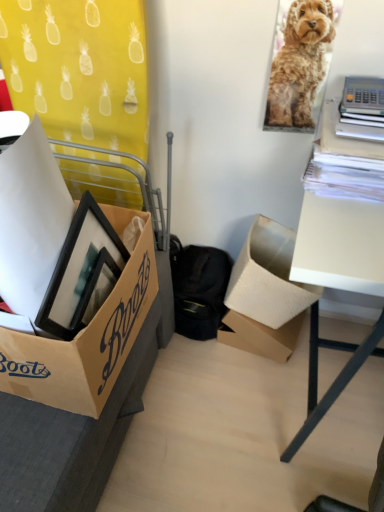
Question: Can you confirm if cardboard box at lower right, the third box viewed from the left, is thinner than brown cardboard box at center, the second box positioned from the left?

Choices:
 (A) yes
 (B) no

Answer: (B)

Question: Is cardboard box at lower right, which is the 1th box in right-to-left order, positioned in front of brown cardboard box at center, the second box positioned from the left?

Choices:
 (A) no
 (B) yes

Answer: (B)

Question: From a real-world perspective, is cardboard box at lower right, which is the 1th box in right-to-left order, located beneath brown cardboard box at center, the second box positioned from the left?

Choices:
 (A) yes
 (B) no

Answer: (B)

Question: Does cardboard box at lower right, the third box viewed from the left, have a lesser height compared to brown cardboard box at center, the second box positioned from the left?

Choices:
 (A) no
 (B) yes

Answer: (A)

Question: Is cardboard box at lower right, the third box viewed from the left, turned away from brown cardboard box at center, the second box positioned from the left?

Choices:
 (A) no
 (B) yes

Answer: (A)

Question: Choose the correct answer: Is brown cardboard box at lower left, marked as the first box in a left-to-right arrangement, inside white matte table at right or outside it?

Choices:
 (A) inside
 (B) outside

Answer: (B)

Question: Would you say brown cardboard box at lower left, positioned as the 3th box in right-to-left order, is to the left or to the right of white matte table at right in the picture?

Choices:
 (A) right
 (B) left

Answer: (B)

Question: Is point click(x=92, y=415) closer or farther from the camera than point click(x=357, y=287)?

Choices:
 (A) closer
 (B) farther

Answer: (B)

Question: In terms of size, does brown cardboard box at lower left, marked as the first box in a left-to-right arrangement, appear bigger or smaller than white matte table at right?

Choices:
 (A) big
 (B) small

Answer: (B)

Question: Is golden fur dog at upper right bigger or smaller than cardboard box at lower right, the third box viewed from the left?

Choices:
 (A) small
 (B) big

Answer: (A)

Question: From the image's perspective, is golden fur dog at upper right above or below cardboard box at lower right, the third box viewed from the left?

Choices:
 (A) above
 (B) below

Answer: (A)

Question: From their relative heights in the image, would you say golden fur dog at upper right is taller or shorter than cardboard box at lower right, which is the 1th box in right-to-left order?

Choices:
 (A) tall
 (B) short

Answer: (A)

Question: Is point (299, 30) closer or farther from the camera than point (244, 248)?

Choices:
 (A) closer
 (B) farther

Answer: (A)

Question: Considering the positions of point (322, 402) and point (296, 101), is point (322, 402) closer or farther from the camera than point (296, 101)?

Choices:
 (A) closer
 (B) farther

Answer: (A)

Question: In terms of size, does white matte table at right appear bigger or smaller than golden fur dog at upper right?

Choices:
 (A) big
 (B) small

Answer: (A)